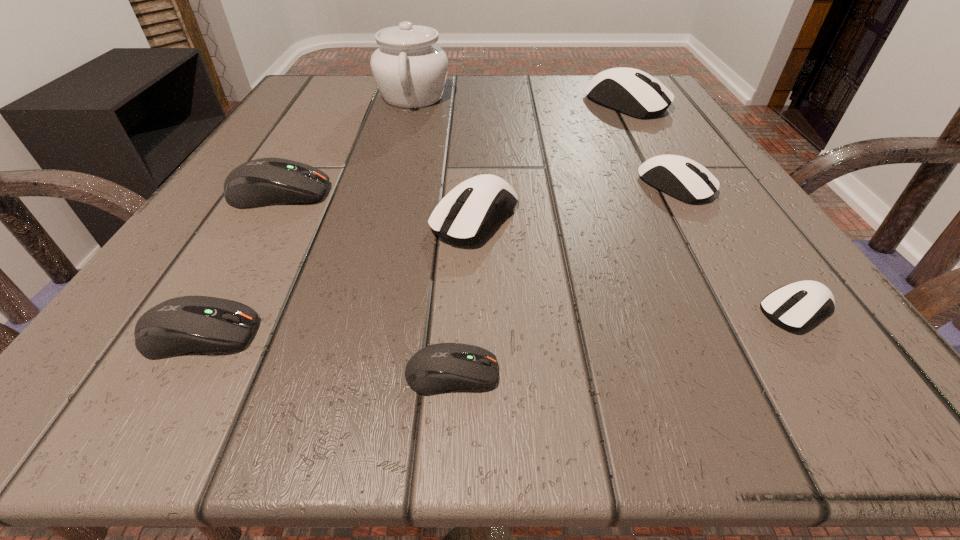
Select which object appears as the second closest to the nearest white mouse. Please provide its 2D coordinates. Your answer should be formatted as a tuple, i.e. [(x, y)], where the tuple contains the x and y coordinates of a point satisfying the conditions above.

[(464, 216)]

Identify which computer equipment is located as the third nearest to the third biggest white mouse. Please provide its 2D coordinates. Your answer should be formatted as a tuple, i.e. [(x, y)], where the tuple contains the x and y coordinates of a point satisfying the conditions above.

[(464, 216)]

Locate an element on the screen. Image resolution: width=960 pixels, height=540 pixels. the seventh closest computer equipment to the tallest object is located at coordinates (790, 306).

You are a GUI agent. You are given a task and a screenshot of the screen. Output one action in this format:
    pyautogui.click(x=<x>, y=<y>)
    Task: Click on the white mouse that is the second closest to the nearest white mouse
    Image resolution: width=960 pixels, height=540 pixels.
    Given the screenshot: What is the action you would take?
    pyautogui.click(x=464, y=216)

Locate which white mouse is the closest to the leftmost white mouse. Please provide its 2D coordinates. Your answer should be formatted as a tuple, i.e. [(x, y)], where the tuple contains the x and y coordinates of a point satisfying the conditions above.

[(682, 178)]

I want to click on the third closest dark computer equipment to the tallest object, so click(x=443, y=367).

This screenshot has height=540, width=960. I want to click on dark computer equipment that is the second closest to the rightmost dark computer equipment, so click(x=262, y=182).

This screenshot has height=540, width=960. In order to click on vacant space that satisfies the following two spatial constraints: 1. on the button of the smallest white mouse; 2. on the right side of the farthest dark computer equipment in this screenshot , I will do `click(209, 310)`.

At what (x,y) coordinates should I click in order to perform the action: click on vacant space that satisfies the following two spatial constraints: 1. on the front side of the leftmost white mouse; 2. on the left side of the white chinaware. Please return your answer as a coordinate pair (x, y). Looking at the image, I should click on (380, 218).

Find the location of a particular element. The width and height of the screenshot is (960, 540). free space that satisfies the following two spatial constraints: 1. on the button of the farthest dark computer equipment; 2. on the back side of the smallest white mouse is located at coordinates tap(209, 310).